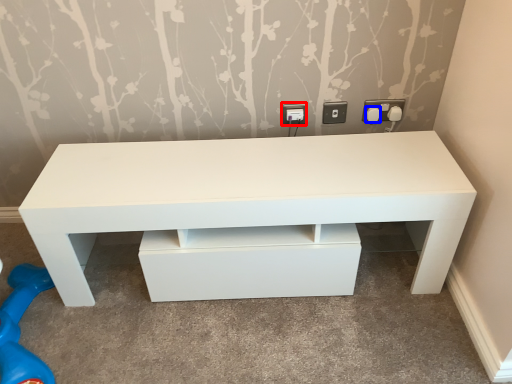
Question: Which point is further to the camera, electric outlet (highlighted by a red box) or knob (highlighted by a blue box)?

Choices:
 (A) electric outlet
 (B) knob

Answer: (A)